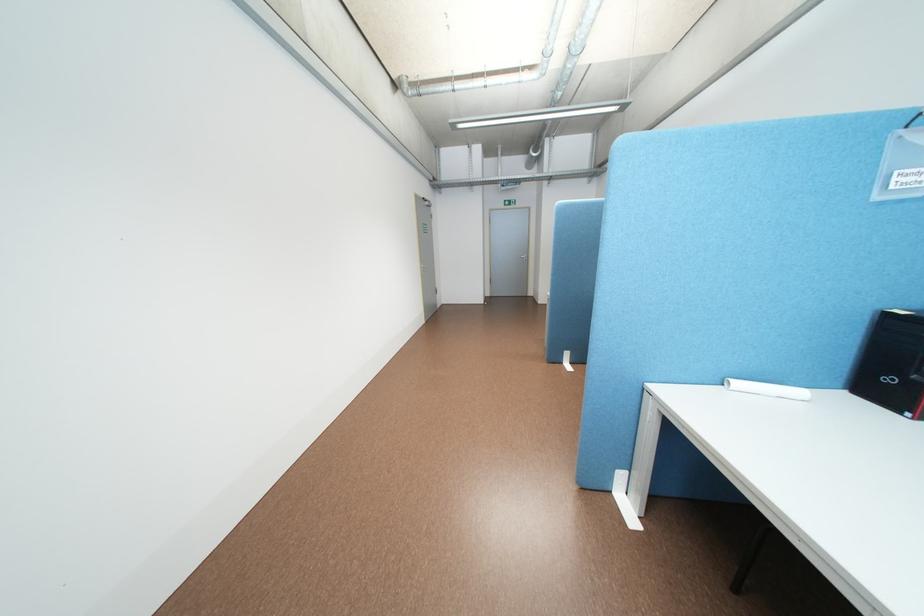
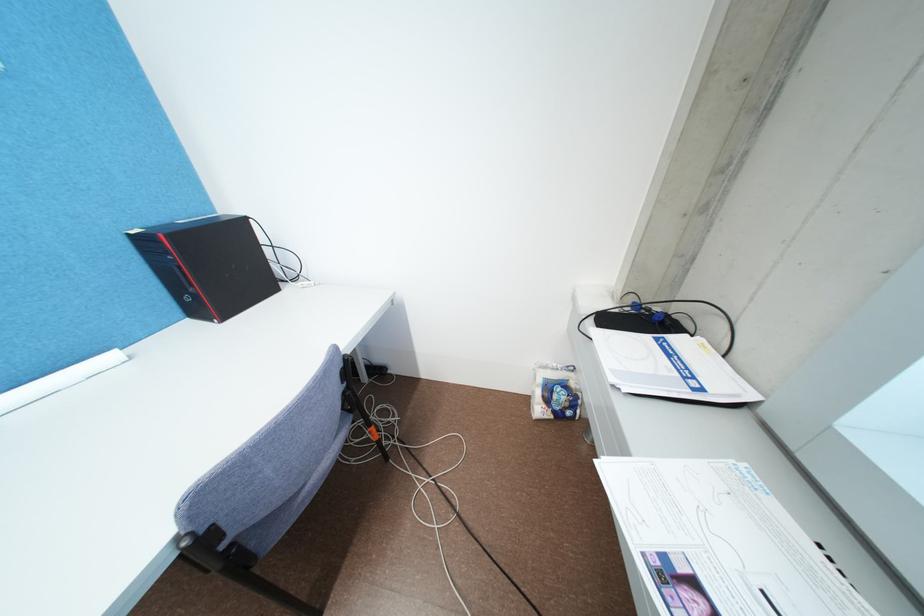
The first image is from the beginning of the video and the second image is from the end. How did the camera likely rotate when shooting the video?

The camera rotated toward right-down.